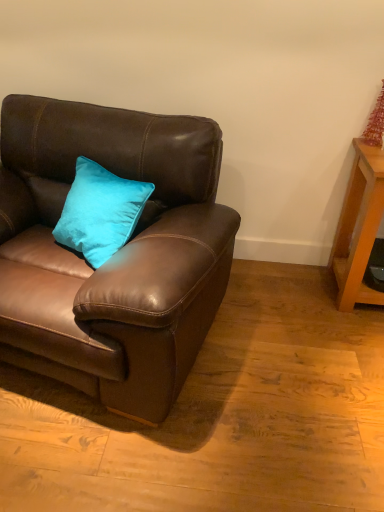
At what (x,y) coordinates should I click in order to perform the action: click on vacant space to the right of brown leather couch at left. Please return your answer as a coordinate pair (x, y). This screenshot has height=512, width=384. Looking at the image, I should click on tap(289, 365).